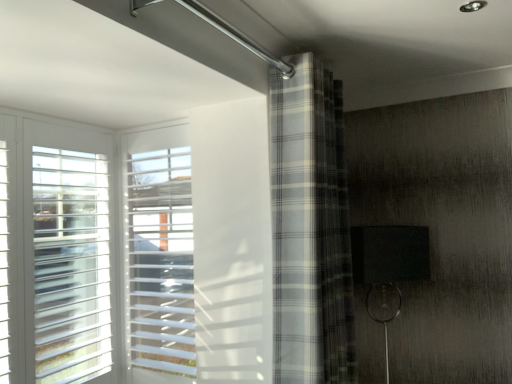
You are a GUI agent. You are given a task and a screenshot of the screen. Output one action in this format:
    pyautogui.click(x=<x>, y=<y>)
    Task: Click on the gray plaid curtain at center
    This screenshot has width=512, height=384.
    Given the screenshot: What is the action you would take?
    pyautogui.click(x=310, y=228)

The image size is (512, 384). What do you see at coordinates (310, 228) in the screenshot?
I see `gray plaid curtain at center` at bounding box center [310, 228].

Find the location of a particular element. white plastic blinds at left is located at coordinates (159, 252).

In order to face white plastic blinds at left, should I rotate leftwards or rightwards?

You should look left and rotate roughly 13.201 degrees.

The image size is (512, 384). Describe the element at coordinates (159, 252) in the screenshot. I see `white plastic blinds at left` at that location.

From the picture: Measure the distance between white plastic blinds at left and camera.

white plastic blinds at left and camera are 1.81 meters apart.

Image resolution: width=512 pixels, height=384 pixels. I want to click on gray plaid curtain at center, so click(x=310, y=228).

Between white plastic blinds at left and gray plaid curtain at center, which one appears on the left side from the viewer's perspective?

Positioned to the left is white plastic blinds at left.

Which object is more forward, white plastic blinds at left or gray plaid curtain at center?

gray plaid curtain at center is closer to the camera.

Is point (128, 287) behind point (322, 103)?

That is True.

From the image's perspective, relative to gray plaid curtain at center, is white plastic blinds at left above or below?

Based on their image positions, white plastic blinds at left is located beneath gray plaid curtain at center.

From a real-world perspective, between white plastic blinds at left and gray plaid curtain at center, who is vertically lower?

white plastic blinds at left, from a real-world perspective.

Considering the sizes of objects white plastic blinds at left and gray plaid curtain at center in the image provided, who is wider, white plastic blinds at left or gray plaid curtain at center?

With larger width is gray plaid curtain at center.

Which of these two, white plastic blinds at left or gray plaid curtain at center, stands taller?

gray plaid curtain at center is taller.

Can you confirm if white plastic blinds at left is smaller than gray plaid curtain at center?

Correct, white plastic blinds at left occupies less space than gray plaid curtain at center.

Is white plastic blinds at left positioned beyond the bounds of gray plaid curtain at center?

white plastic blinds at left lies outside gray plaid curtain at center's area.

Would you consider white plastic blinds at left to be distant from gray plaid curtain at center?

No, white plastic blinds at left is not far away from gray plaid curtain at center.

Does white plastic blinds at left turn towards gray plaid curtain at center?

No.

How many degrees apart are the facing directions of white plastic blinds at left and gray plaid curtain at center?

white plastic blinds at left and gray plaid curtain at center are facing 87.5 degrees away from each other.

How much distance is there between white plastic blinds at left and gray plaid curtain at center?

They are 25.36 inches apart.

Locate an element on the screen. window to the left of gray plaid curtain at center is located at coordinates (159, 252).

Based on their positions, is gray plaid curtain at center located to the left or right of white plastic blinds at left?

Based on their positions, gray plaid curtain at center is located to the right of white plastic blinds at left.

In the image, is gray plaid curtain at center positioned in front of or behind white plastic blinds at left?

gray plaid curtain at center is positioned closer to the viewer than white plastic blinds at left.

Which is closer, (x=295, y=103) or (x=193, y=299)?

The point (x=295, y=103) is closer to the camera.

From the image's perspective, between gray plaid curtain at center and white plastic blinds at left, which one is located above?

gray plaid curtain at center appears higher in the image.

From a real-world perspective, is gray plaid curtain at center above or below white plastic blinds at left?

gray plaid curtain at center is situated higher than white plastic blinds at left in the real world.

Between gray plaid curtain at center and white plastic blinds at left, which one has larger width?

Wider between the two is gray plaid curtain at center.

Can you confirm if gray plaid curtain at center is shorter than white plastic blinds at left?

Incorrect, the height of gray plaid curtain at center does not fall short of that of white plastic blinds at left.

Based on their sizes in the image, would you say gray plaid curtain at center is bigger or smaller than white plastic blinds at left?

In the image, gray plaid curtain at center appears to be larger than white plastic blinds at left.

Which is correct: gray plaid curtain at center is inside white plastic blinds at left, or outside of it?

The correct answer is: outside.

Is gray plaid curtain at center not close to white plastic blinds at left?

No, gray plaid curtain at center is not far from white plastic blinds at left.

Could you tell me if gray plaid curtain at center is facing white plastic blinds at left?

No, gray plaid curtain at center does not turn towards white plastic blinds at left.

Where is `curtain positioned vertically above the white plastic blinds at left (from a real-world perspective)`? Image resolution: width=512 pixels, height=384 pixels. curtain positioned vertically above the white plastic blinds at left (from a real-world perspective) is located at coordinates (310, 228).

There is a white plastic blinds at left. At what (x,y) coordinates should I click in order to perform the action: click on curtain above it (from a real-world perspective). Please return your answer as a coordinate pair (x, y). Looking at the image, I should click on (310, 228).

Locate an element on the screen. window lying on the left of gray plaid curtain at center is located at coordinates (159, 252).